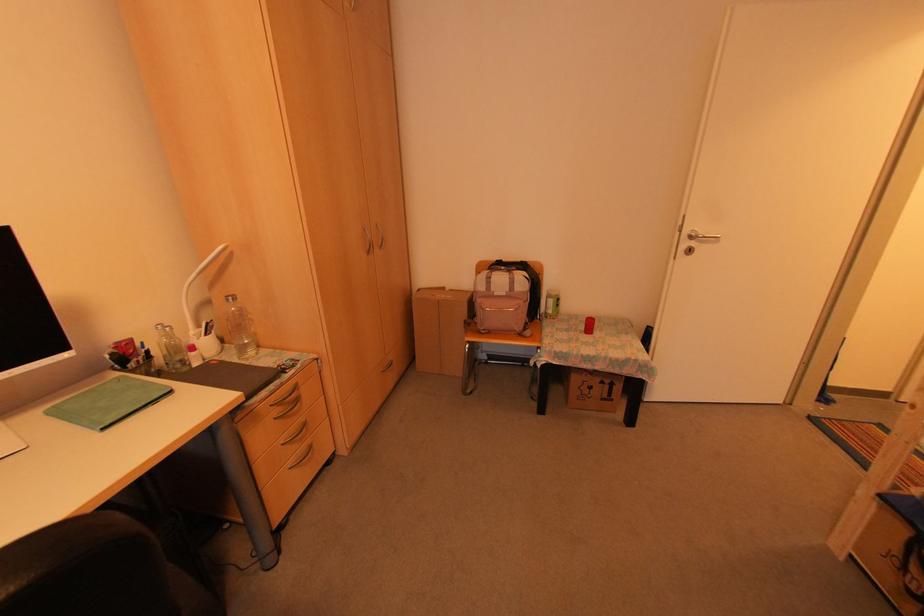
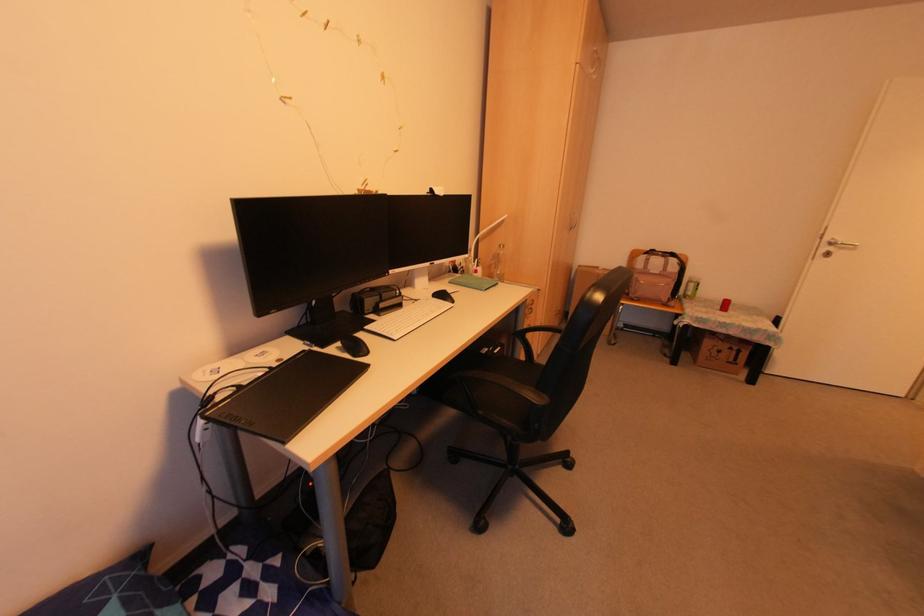
Where in the second image is the point corresponding to point (543, 314) from the first image?

(683, 296)